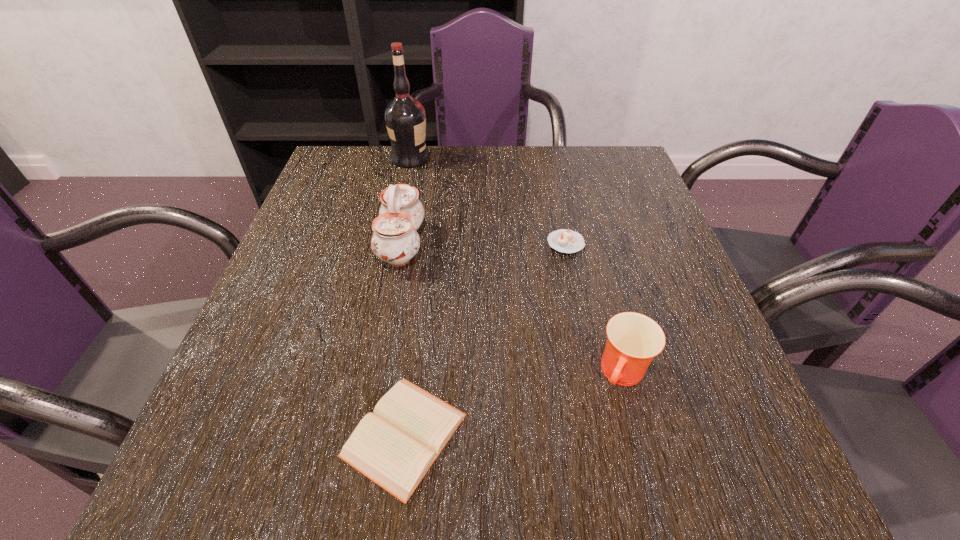
Image resolution: width=960 pixels, height=540 pixels. What are the coordinates of `vacant space that satisfies the following two spatial constraints: 1. on the surface of the liquor; 2. on the right side of the diary` in the screenshot? It's located at (350, 435).

At what (x,y) coordinates should I click in order to perform the action: click on vacant space that satisfies the following two spatial constraints: 1. by the handle of the third tallest object; 2. on the left side of the chinaware. Please return your answer as a coordinate pair (x, y). The height and width of the screenshot is (540, 960). Looking at the image, I should click on (376, 374).

The width and height of the screenshot is (960, 540). Identify the location of free space that satisfies the following two spatial constraints: 1. by the handle of the shortest object; 2. on the right side of the fourth shortest object. (365, 435).

The height and width of the screenshot is (540, 960). I want to click on free spot that satisfies the following two spatial constraints: 1. on the back side of the shortest object; 2. on the right side of the second shortest object, so click(428, 243).

Where is `vacant point that satisfies the following two spatial constraints: 1. on the back side of the cup; 2. by the handle of the fourth shortest object`? Image resolution: width=960 pixels, height=540 pixels. vacant point that satisfies the following two spatial constraints: 1. on the back side of the cup; 2. by the handle of the fourth shortest object is located at coordinates (588, 244).

The image size is (960, 540). In order to click on free space that satisfies the following two spatial constraints: 1. by the handle of the fourth shortest object; 2. on the left side of the diary in this screenshot , I will do `click(365, 435)`.